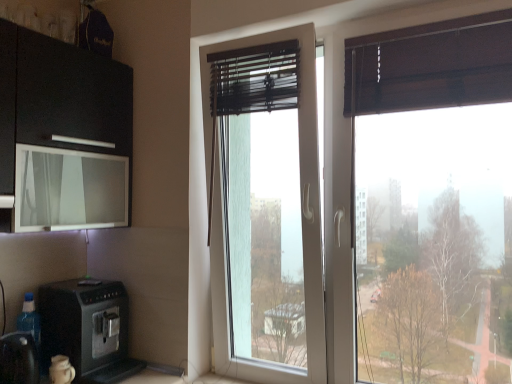
Question: In terms of size, does black plastic coffee machine at lower left appear bigger or smaller than black plastic coffee machine at lower left?

Choices:
 (A) small
 (B) big

Answer: (A)

Question: From the image's perspective, is black plastic coffee machine at lower left located above or below black plastic coffee machine at lower left?

Choices:
 (A) below
 (B) above

Answer: (A)

Question: Which object is the closest to the transparent glass window at center?

Choices:
 (A) transparent glass window screen at upper left
 (B) black plastic coffee machine at lower left
 (C) black plastic coffee machine at lower left

Answer: (A)

Question: Estimate the real-world distances between objects in this image. Which object is farther from the transparent glass window at center?

Choices:
 (A) black plastic coffee machine at lower left
 (B) transparent glass window screen at upper left
 (C) black plastic coffee machine at lower left

Answer: (C)